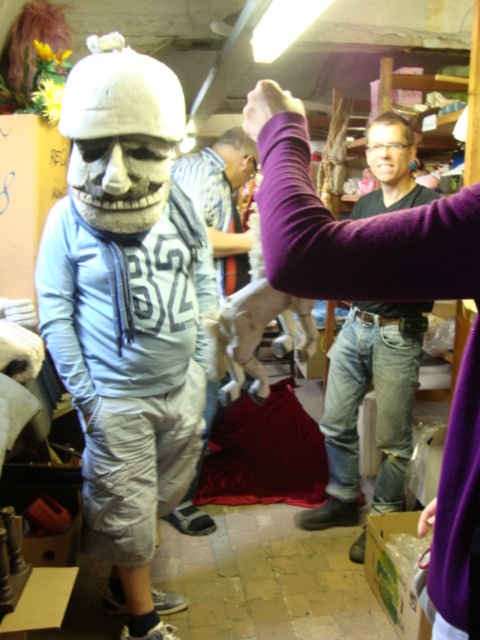
Question: Among these objects, which one is farthest from the camera?

Choices:
 (A) matte white mask at center
 (B) light blue fabric shirt at center
 (C) matte black shirt at center

Answer: (B)

Question: Can you confirm if matte white mask at center is thinner than matte black shirt at center?

Choices:
 (A) no
 (B) yes

Answer: (A)

Question: Based on their relative distances, which object is nearer to the white matte skull at center?

Choices:
 (A) light blue fabric shirt at center
 (B) matte white mask at center

Answer: (B)

Question: Is matte white mask at center positioned before matte black shirt at center?

Choices:
 (A) no
 (B) yes

Answer: (B)

Question: Does matte white mask at center have a larger size compared to white matte skull at center?

Choices:
 (A) no
 (B) yes

Answer: (B)

Question: Considering the real-world distances, which object is closest to the matte black shirt at center?

Choices:
 (A) light blue fabric shirt at center
 (B) matte white mask at center
 (C) white matte skull at center

Answer: (A)